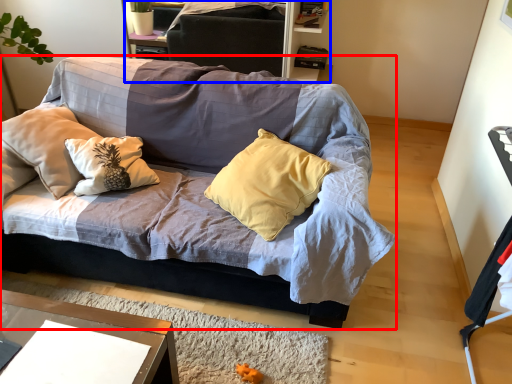
Question: Which object is closer to the camera taking this photo, studio couch (highlighted by a red box) or dresser (highlighted by a blue box)?

Choices:
 (A) studio couch
 (B) dresser

Answer: (A)